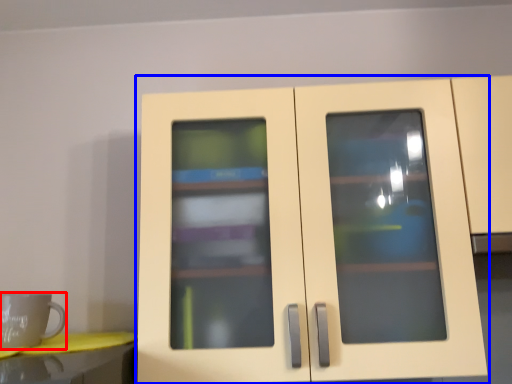
Question: Which object is further to the camera taking this photo, mug (highlighted by a red box) or cupboard (highlighted by a blue box)?

Choices:
 (A) mug
 (B) cupboard

Answer: (A)